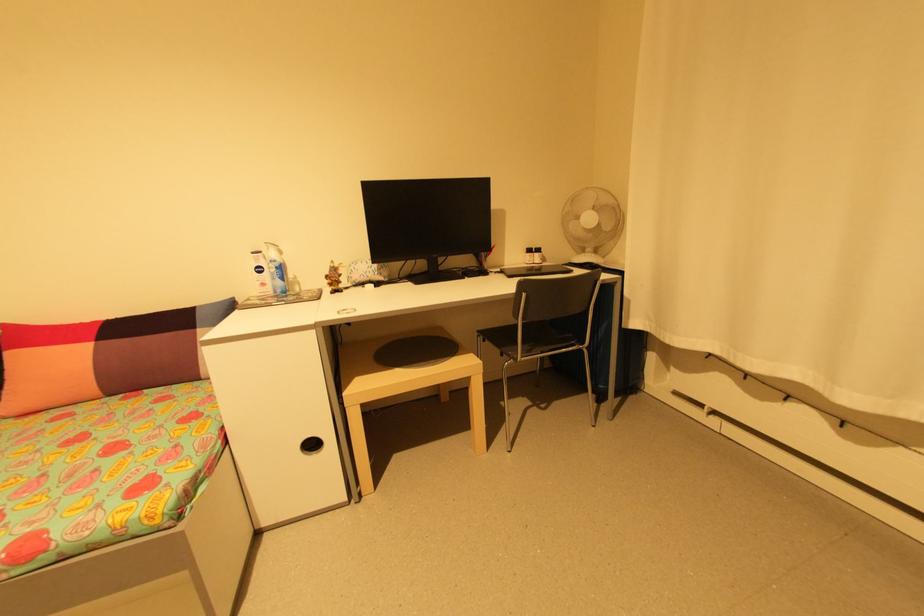
Image resolution: width=924 pixels, height=616 pixels. Find the location of `closed black laptop`. closed black laptop is located at coordinates (428, 222).